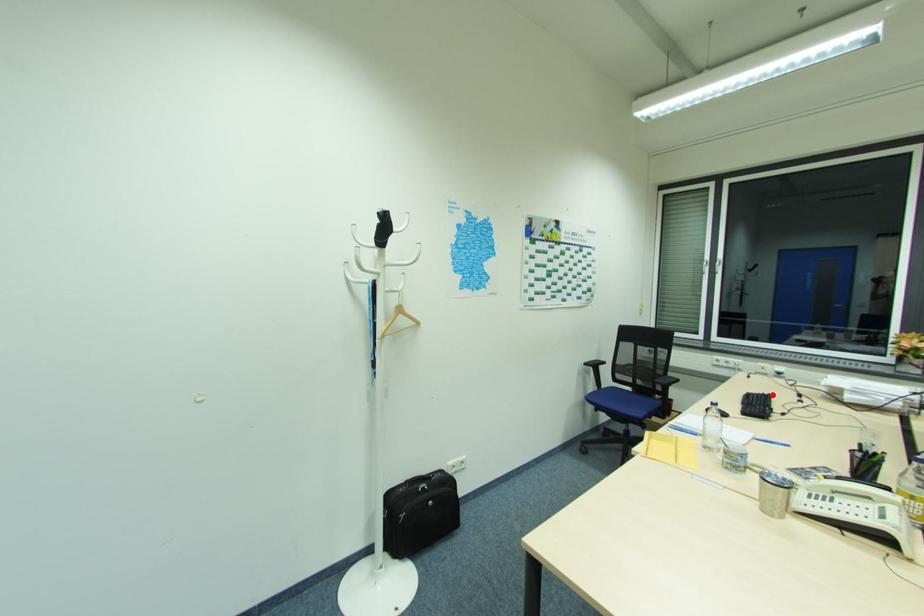
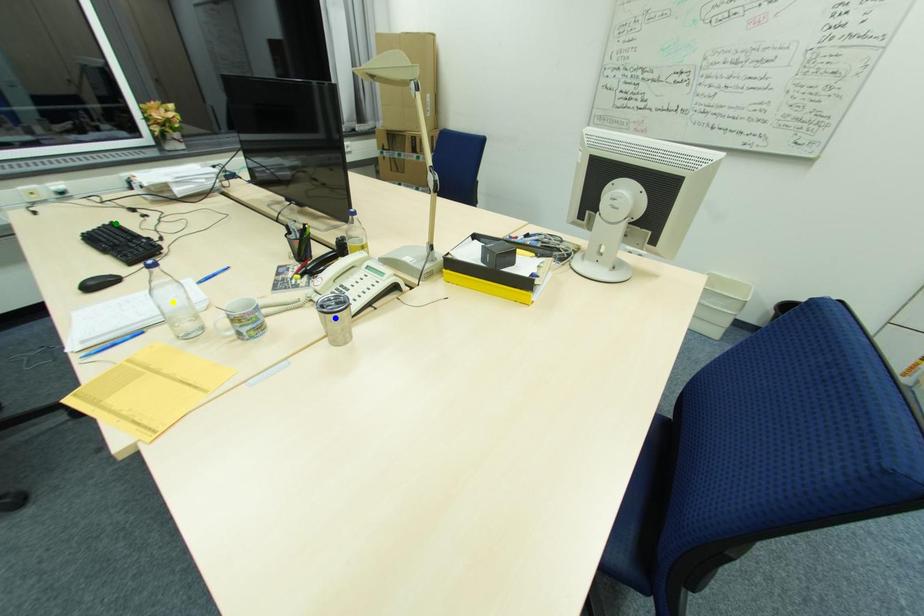
Question: I am providing you with two images of the same scene from different viewpoints. A red point is marked on the first image. You are given multiple points on the second image. Which spot in image 2 lines up with the point in image 1?

Choices:
 (A) green point
 (B) yellow point
 (C) blue point

Answer: (A)